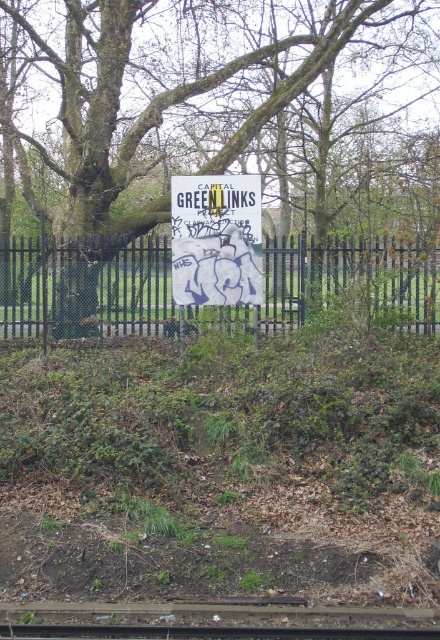
Question: Estimate the real-world distances between objects in this image. Which object is farther from the green rough bark tree at center?

Choices:
 (A) white paper sign at center
 (B) brown wooden train track at lower center
 (C) black metal train track at center
 (D) black metal fence at center

Answer: (C)

Question: Which point appears closest to the camera in this image?

Choices:
 (A) (253, 300)
 (B) (110, 316)
 (C) (11, 604)
 (D) (260, 636)

Answer: (D)

Question: Which object appears closest to the camera in this image?

Choices:
 (A) black metal fence at center
 (B) white paper sign at center
 (C) green rough bark tree at center

Answer: (C)

Question: Does brown wooden train track at lower center appear on the right side of black metal train track at center?

Choices:
 (A) no
 (B) yes

Answer: (A)

Question: Does green rough bark tree at center appear on the right side of brown wooden train track at lower center?

Choices:
 (A) no
 (B) yes

Answer: (A)

Question: Can you confirm if green rough bark tree at center is bigger than white paper sign at center?

Choices:
 (A) no
 (B) yes

Answer: (B)